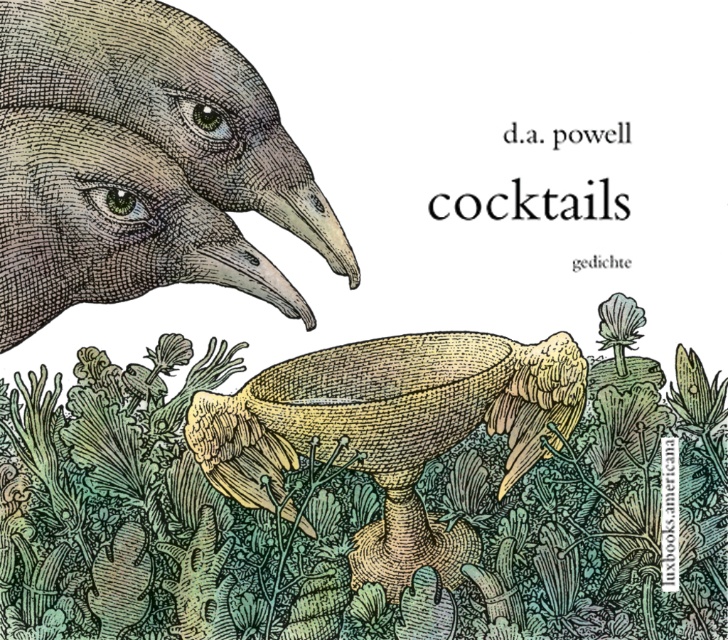
Between green textured plant at lower center and yellow woven basket at center, which one has less height?

yellow woven basket at center is shorter.

Does green textured plant at lower center appear over yellow woven basket at center?

Correct, green textured plant at lower center is located above yellow woven basket at center.

Where is `green textured plant at lower center`? This screenshot has height=640, width=728. green textured plant at lower center is located at coordinates (364, 492).

Does brown textured bird head at upper left appear on the left side of yellow woven basket at center?

Indeed, brown textured bird head at upper left is positioned on the left side of yellow woven basket at center.

Is brown textured bird head at upper left positioned before yellow woven basket at center?

That is True.

Where is `brown textured bird head at upper left`? This screenshot has width=728, height=640. brown textured bird head at upper left is located at coordinates (138, 163).

Which is more to the right, green textured plant at lower center or brown textured bird head at upper left?

From the viewer's perspective, green textured plant at lower center appears more on the right side.

The image size is (728, 640). Find the location of `green textured plant at lower center`. green textured plant at lower center is located at coordinates (364, 492).

The width and height of the screenshot is (728, 640). Find the location of `green textured plant at lower center`. green textured plant at lower center is located at coordinates (364, 492).